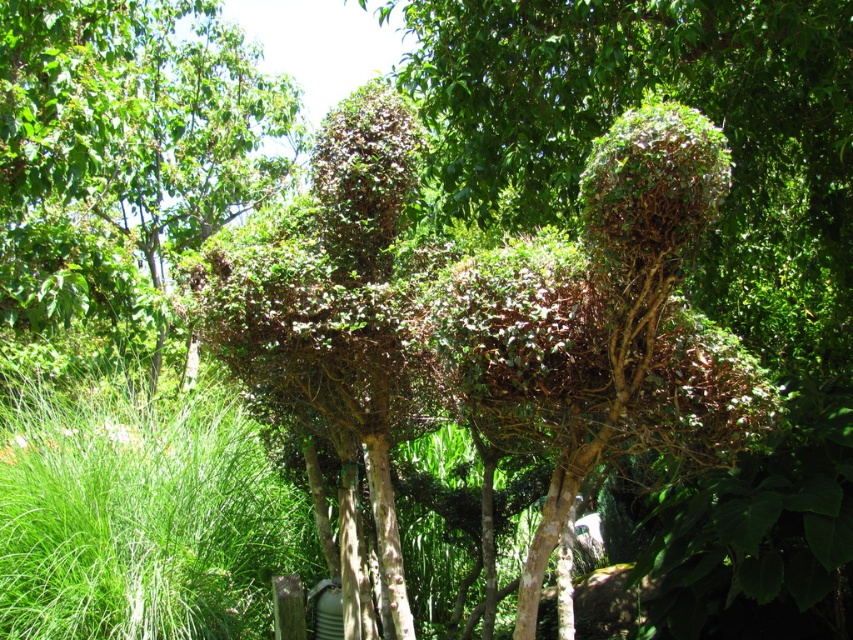
You are a gardener planning to place a small decorative statue in the garden. The statue requires a space wider than the green leafy bush at center but narrower than the green leafy grass at lower left. Is there a suitable spot in the garden for the statue?

The green leafy bush at center is narrower than the green leafy grass at lower left. Therefore, a space between their widths could accommodate the statue.

You are a gardener who wants to plant a new flower that requires full sunlight. You have two options in the garden scene shown. Which location would be better for planting the flower? The green leafy bush at center or the green leafy grass at lower left?

The green leafy grass at lower left is better because the green leafy bush at center is not as tall as it, meaning the grass area likely receives more sunlight due to being in a less shaded area.